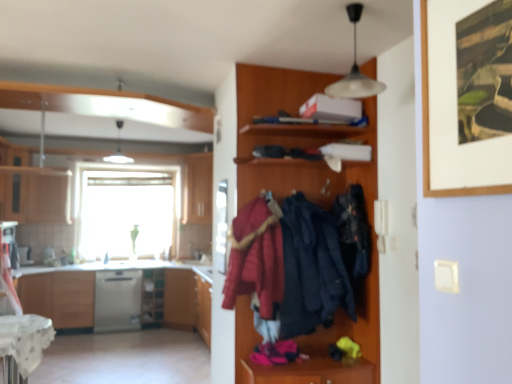
The height and width of the screenshot is (384, 512). I want to click on vacant space situated above white matte pendant light at upper center (from a real-world perspective), so click(354, 7).